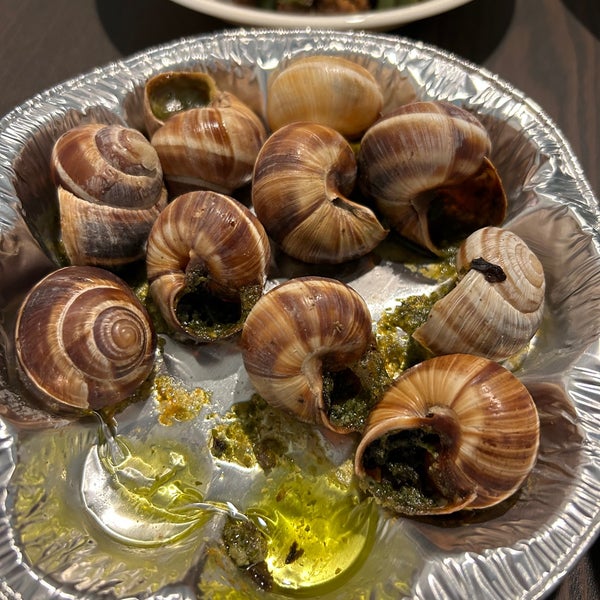
You are a GUI agent. You are given a task and a screenshot of the screen. Output one action in this format:
    pyautogui.click(x=<x>, y=<y>)
    Task: Click on the metal pan
    The height and width of the screenshot is (600, 600).
    Given the screenshot: What is the action you would take?
    pyautogui.click(x=562, y=390)